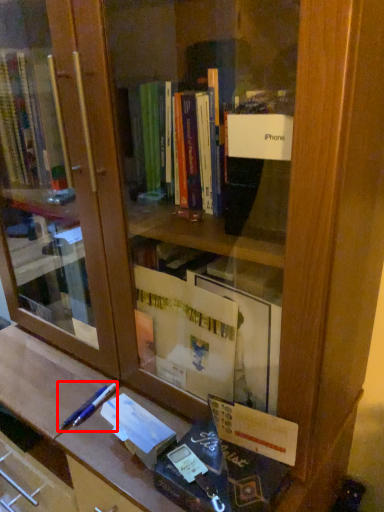
Question: From the image's perspective, what is the correct spatial relationship of pencil (annotated by the red box) in relation to paperback book?

Choices:
 (A) above
 (B) below

Answer: (A)